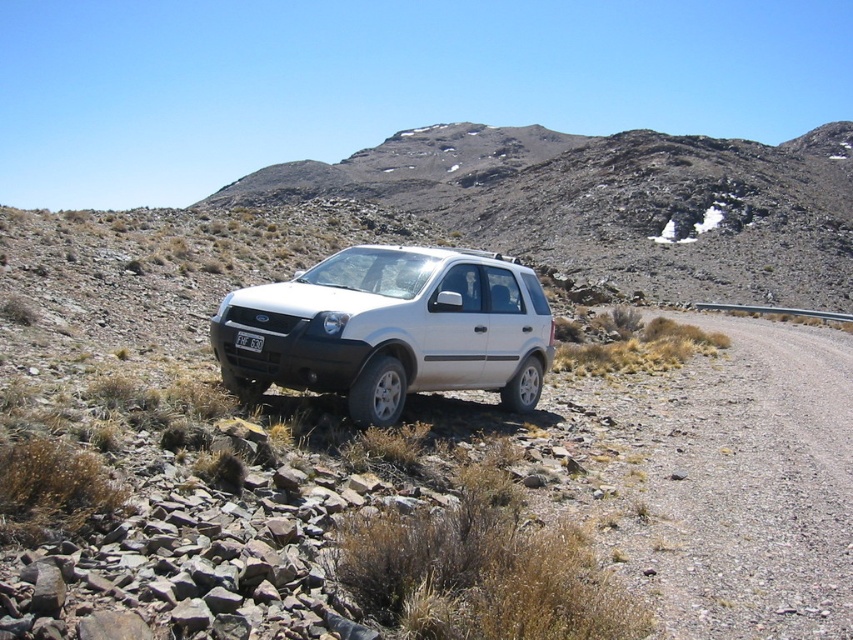
In the scene shown: You are driving a white matte suv at center and want to exit the gray gravel road at right. Which direction should you turn to leave the road?

To exit the gray gravel road at right, you should turn to the left since the gray gravel road at right is located to the right of the white matte suv at center.

You are a photographer trying to capture the white matte suv at center and the white plastic license plate at center in a single shot. Based on their positions, which object should you adjust your camera to focus on first to ensure both are in frame?

The white plastic license plate at center should be focused on first since the white matte suv at center is to the right of it, allowing you to adjust the camera to include both objects in the frame.

You are a driver trying to park your car on the gray gravel road at right. You see the white plastic license plate at center in your rearview mirror. Which direction should you turn to align your car with the road?

You should turn to the right because the gray gravel road at right is to the right of the white plastic license plate at center, so turning right will align your car with the road.